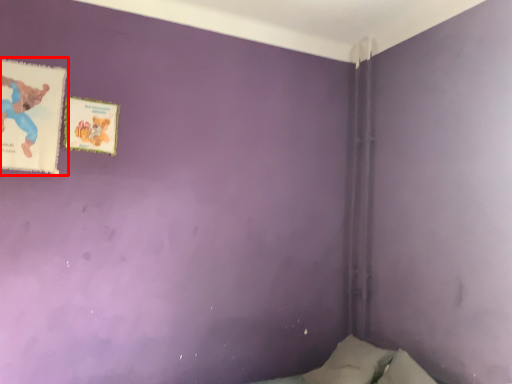
Question: From the image's perspective, what is the correct spatial relationship of paperback book (annotated by the red box) in relation to paperback book?

Choices:
 (A) above
 (B) below

Answer: (A)